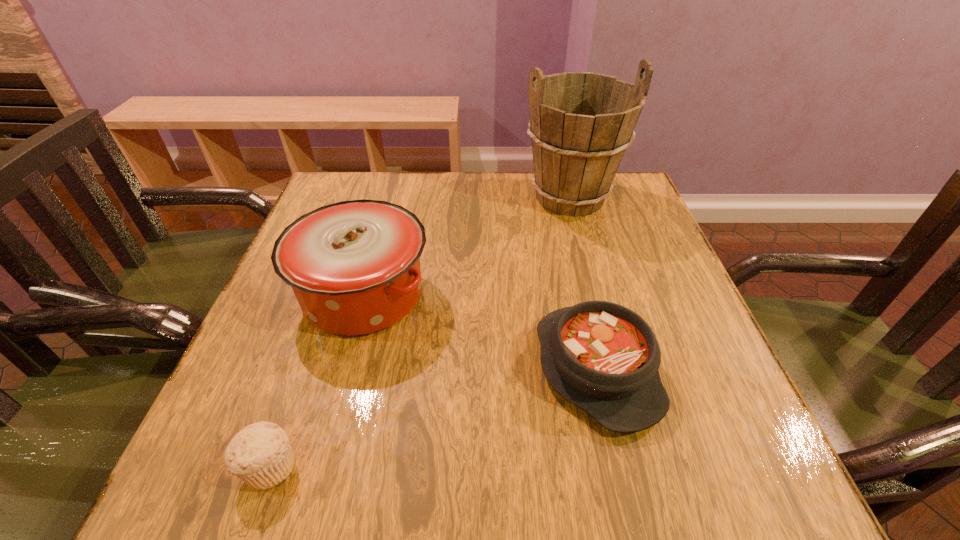
You are a GUI agent. You are given a task and a screenshot of the screen. Output one action in this format:
    pyautogui.click(x=<x>, y=<y>)
    Task: Click on the free point between the taller casserole and the tallest object
    
    Given the screenshot: What is the action you would take?
    pyautogui.click(x=467, y=246)

In order to click on free spot between the tallest object and the right casserole in this screenshot , I will do `click(583, 283)`.

Identify the location of vacant region between the shorter casserole and the bucket. (583, 283).

The width and height of the screenshot is (960, 540). I want to click on empty location between the left casserole and the farthest object, so click(x=467, y=246).

You are a GUI agent. You are given a task and a screenshot of the screen. Output one action in this format:
    pyautogui.click(x=<x>, y=<y>)
    Task: Click on the vacant area that lies between the right casserole and the muffin
    
    Given the screenshot: What is the action you would take?
    coord(433,417)

Find the location of a particular element. object that stands as the second closest to the shorter casserole is located at coordinates (581, 123).

Point out which object is positioned as the second nearest to the bucket. Please provide its 2D coordinates. Your answer should be formatted as a tuple, i.e. [(x, y)], where the tuple contains the x and y coordinates of a point satisfying the conditions above.

[(604, 358)]

Locate an element on the screen. vacant point that satisfies the following two spatial constraints: 1. on the back side of the muffin; 2. on the right side of the bucket is located at coordinates point(363,198).

Identify the location of vacant area in the image that satisfies the following two spatial constraints: 1. on the back side of the muffin; 2. on the right side of the tallest object. (363, 198).

Where is `vacant space that satisfies the following two spatial constraints: 1. on the back side of the right casserole; 2. on the right side of the muffin`? The width and height of the screenshot is (960, 540). vacant space that satisfies the following two spatial constraints: 1. on the back side of the right casserole; 2. on the right side of the muffin is located at coordinates (303, 369).